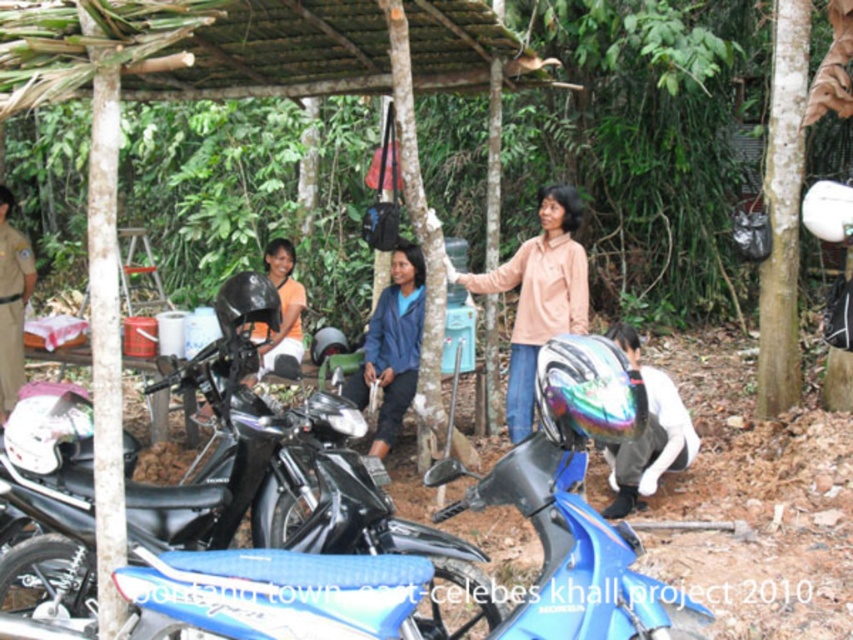
Measure the distance between blue glossy motorcycle at lower center and camera.

blue glossy motorcycle at lower center is 3.15 meters away from camera.

Can you confirm if blue glossy motorcycle at lower center is shorter than rainbow reflective helmet at lower right?

Yes.

The width and height of the screenshot is (853, 640). Describe the element at coordinates (579, 508) in the screenshot. I see `blue glossy motorcycle at lower center` at that location.

Where is `blue glossy motorcycle at lower center`? blue glossy motorcycle at lower center is located at coordinates 579,508.

Which is more to the left, matte pink shirt at center or brown uniform at left?

brown uniform at left

The width and height of the screenshot is (853, 640). What do you see at coordinates (538, 296) in the screenshot?
I see `matte pink shirt at center` at bounding box center [538, 296].

Find the location of a particular element. This screenshot has height=640, width=853. matte pink shirt at center is located at coordinates (538, 296).

Does blue glossy motorcycle at lower center have a greater height compared to matte pink shirt at center?

In fact, blue glossy motorcycle at lower center may be shorter than matte pink shirt at center.

You are a GUI agent. You are given a task and a screenshot of the screen. Output one action in this format:
    pyautogui.click(x=<x>, y=<y>)
    Task: Click on the blue glossy motorcycle at lower center
    The width and height of the screenshot is (853, 640).
    Given the screenshot: What is the action you would take?
    pyautogui.click(x=579, y=508)